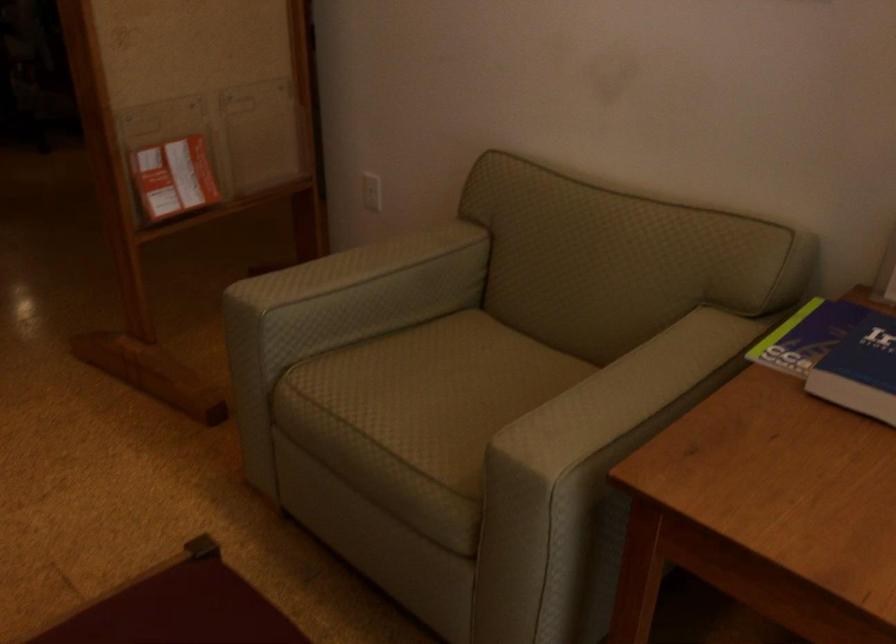
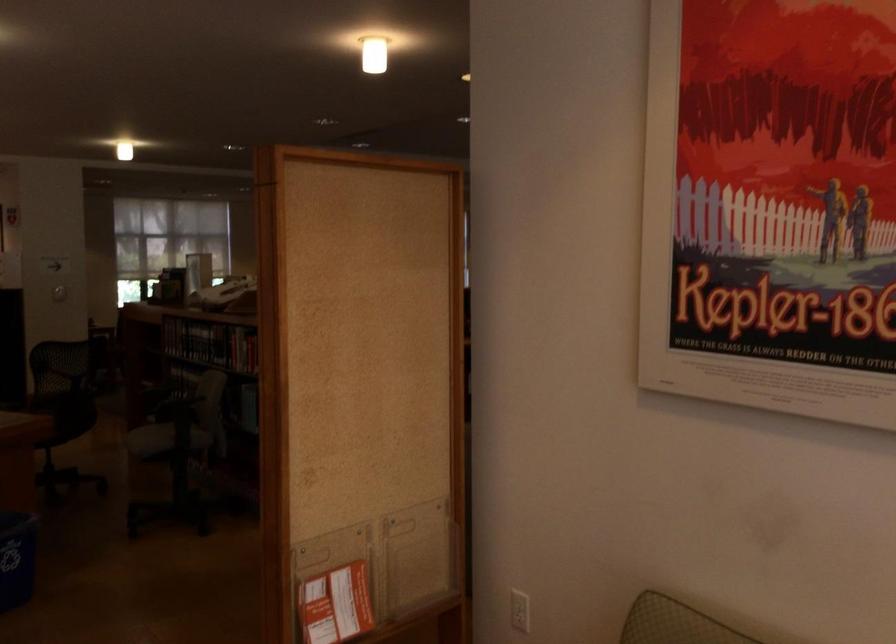
In the second image, find the point that corresponds to (x=168, y=183) in the first image.

(336, 605)